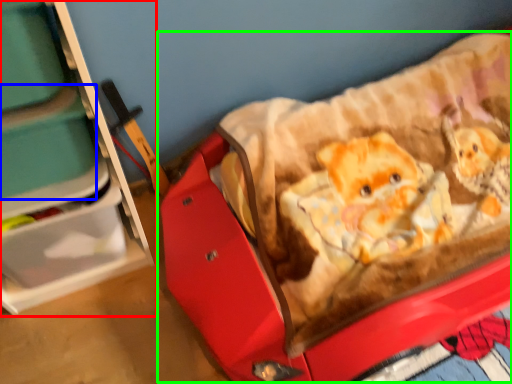
Question: Which object is the closest to the furniture (highlighted by a red box)? Choose among these: storage box (highlighted by a blue box) or baby carriage (highlighted by a green box).

Choices:
 (A) storage box
 (B) baby carriage

Answer: (A)